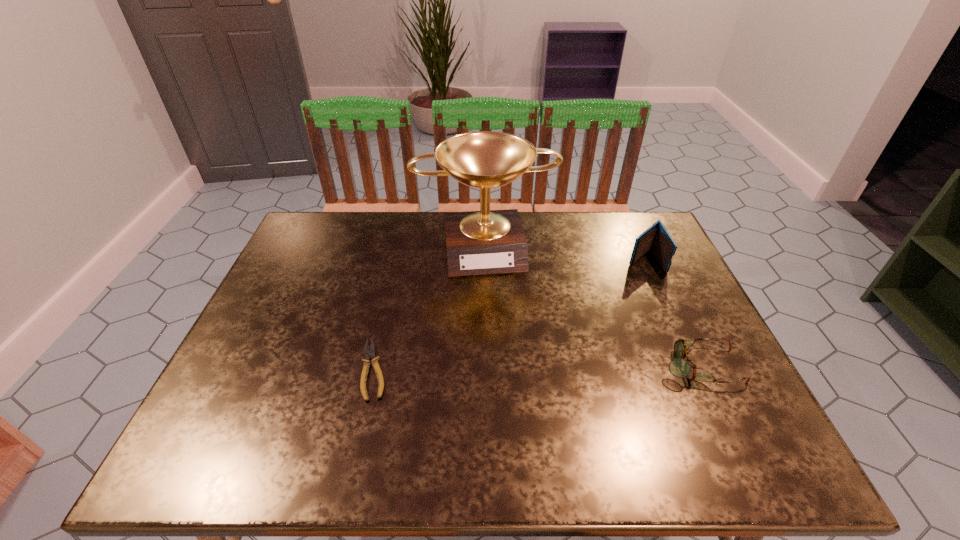
The width and height of the screenshot is (960, 540). What are the coordinates of `vacant region that satisfies the following two spatial constraints: 1. on the front side of the tallest object; 2. on the front-facing side of the third tallest object` in the screenshot? It's located at (487, 366).

Where is `free point that satisfies the following two spatial constraints: 1. on the back side of the third tallest object; 2. on the front-facing side of the leftmost object`? The height and width of the screenshot is (540, 960). free point that satisfies the following two spatial constraints: 1. on the back side of the third tallest object; 2. on the front-facing side of the leftmost object is located at coordinates (374, 366).

I want to click on vacant space that satisfies the following two spatial constraints: 1. on the front side of the award; 2. on the front-facing side of the spectacles, so click(x=487, y=366).

You are a GUI agent. You are given a task and a screenshot of the screen. Output one action in this format:
    pyautogui.click(x=<x>, y=<y>)
    Task: Click on the free region that satisfies the following two spatial constraints: 1. on the front side of the spectacles; 2. on the front-facing side of the tallest object
    
    Given the screenshot: What is the action you would take?
    pyautogui.click(x=487, y=366)

Locate an element on the screen. This screenshot has height=540, width=960. vacant space that satisfies the following two spatial constraints: 1. on the front side of the wallet; 2. on the right side of the award is located at coordinates (486, 260).